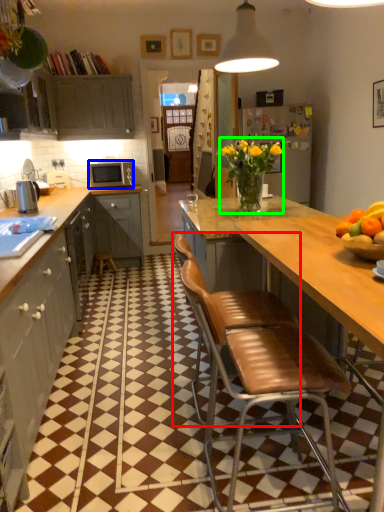
Question: Which object is the farthest from chair (highlighted by a red box)? Choose among these: microwave oven (highlighted by a blue box) or floral arrangement (highlighted by a green box).

Choices:
 (A) microwave oven
 (B) floral arrangement

Answer: (A)